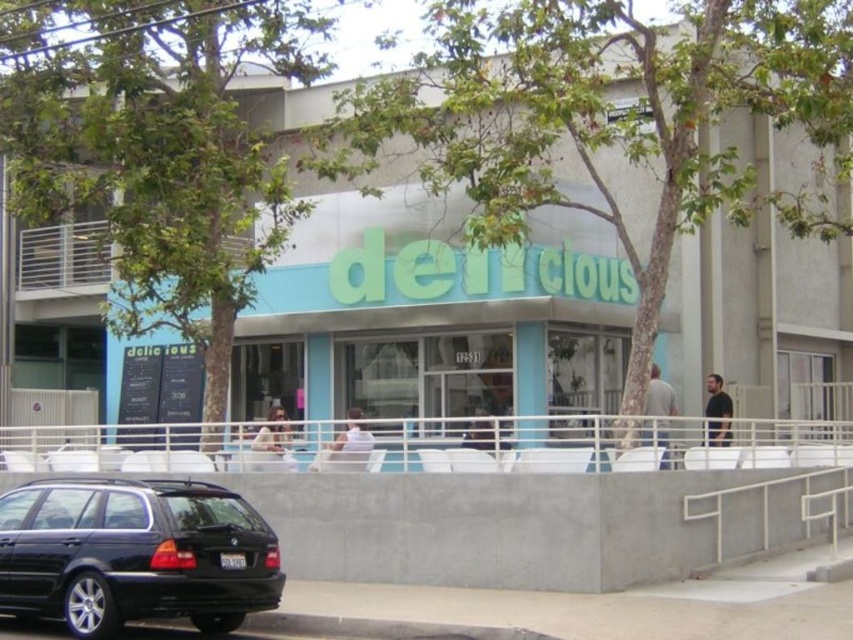
Who is positioned more to the left, blue glass storefront at center or dark gray shirt at right?

From the viewer's perspective, blue glass storefront at center appears more on the left side.

Can you confirm if blue glass storefront at center is positioned to the right of dark gray shirt at right?

No, blue glass storefront at center is not to the right of dark gray shirt at right.

Which is behind, point (676, 124) or point (723, 401)?

Positioned behind is point (723, 401).

In order to click on blue glass storefront at center in this screenshot , I will do `click(560, 182)`.

Based on the photo, is gray fabric shirt at center smaller than dark gray shirt at right?

No.

Is gray fabric shirt at center closer to the viewer compared to dark gray shirt at right?

Yes, it is.

This screenshot has width=853, height=640. What do you see at coordinates (659, 396) in the screenshot? I see `gray fabric shirt at center` at bounding box center [659, 396].

Find the location of a particular element. The height and width of the screenshot is (640, 853). gray fabric shirt at center is located at coordinates (659, 396).

Can you confirm if black matte wagon at lower left is positioned below light brown wooden chair at center?

Indeed, black matte wagon at lower left is positioned under light brown wooden chair at center.

Is black matte wagon at lower left bigger than light brown wooden chair at center?

Indeed, black matte wagon at lower left has a larger size compared to light brown wooden chair at center.

Between point (64, 508) and point (273, 444), which one is positioned behind?

Positioned behind is point (273, 444).

Find the location of `black matte wagon at lower left`. black matte wagon at lower left is located at coordinates (134, 554).